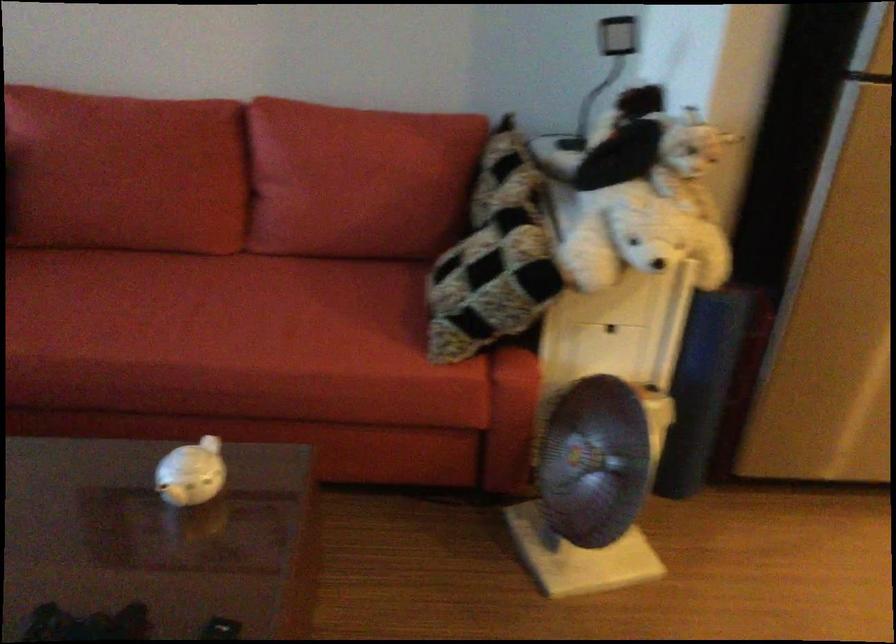
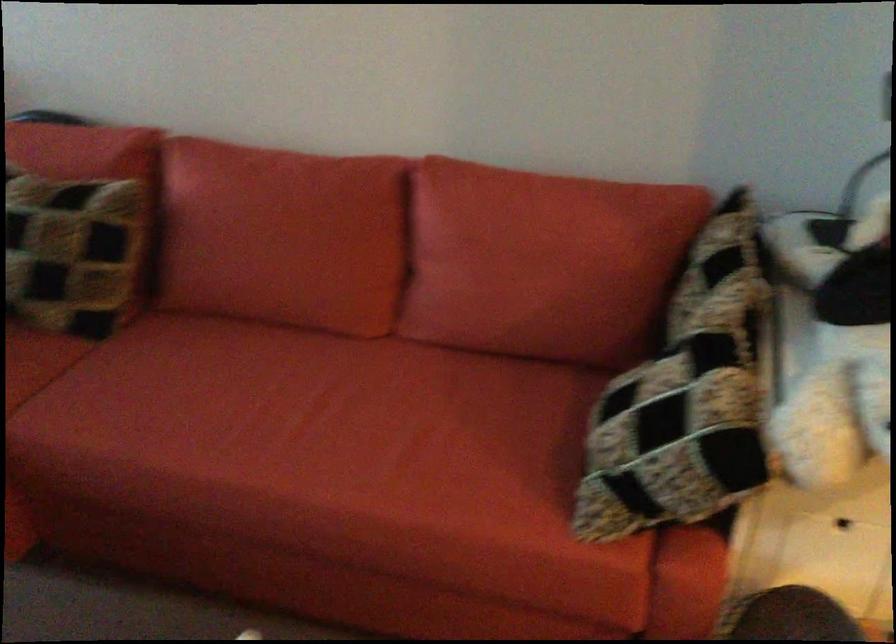
Question: The first image is from the beginning of the video and the second image is from the end. How did the camera likely rotate when shooting the video?

Choices:
 (A) Left
 (B) Right
 (C) Up
 (D) Down

Answer: (A)